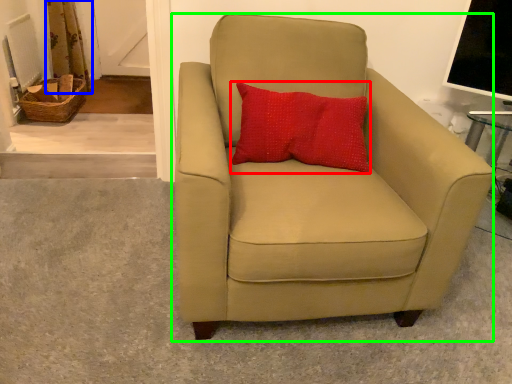
Question: Which object is positioned farthest from pillow (highlighted by a red box)? Select from curtain (highlighted by a blue box) and chair (highlighted by a green box).

Choices:
 (A) curtain
 (B) chair

Answer: (A)